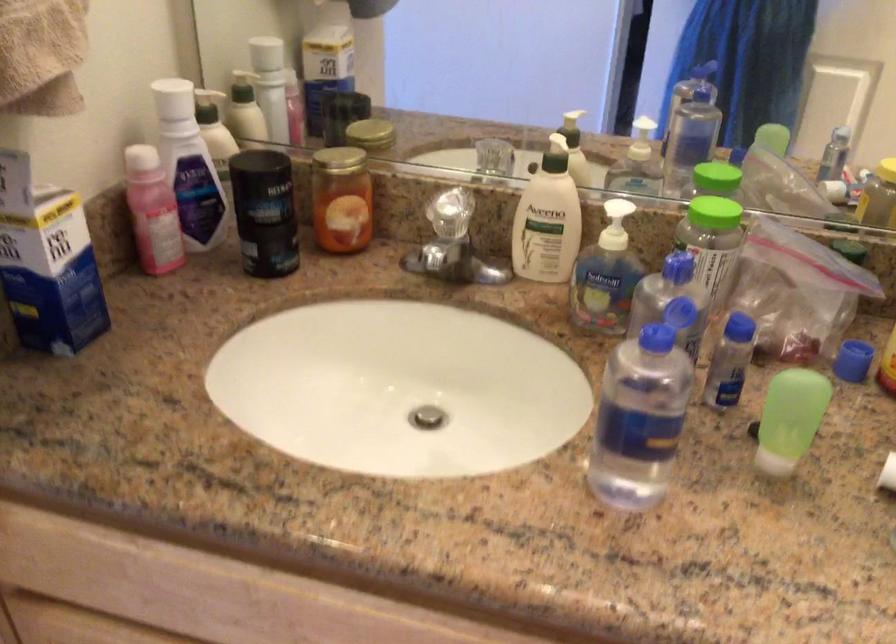
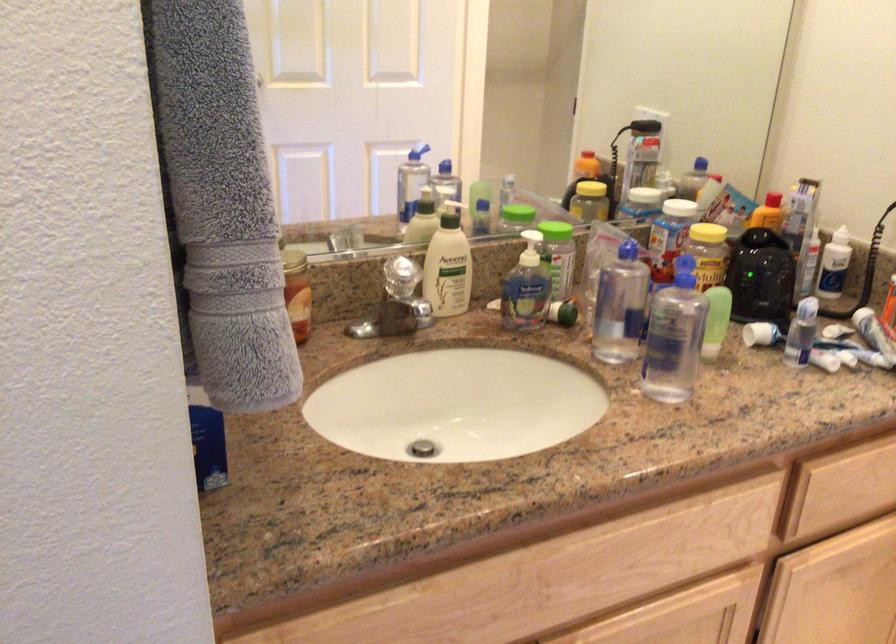
Where in the second image is the point corresponding to point (531, 219) from the first image?

(448, 265)